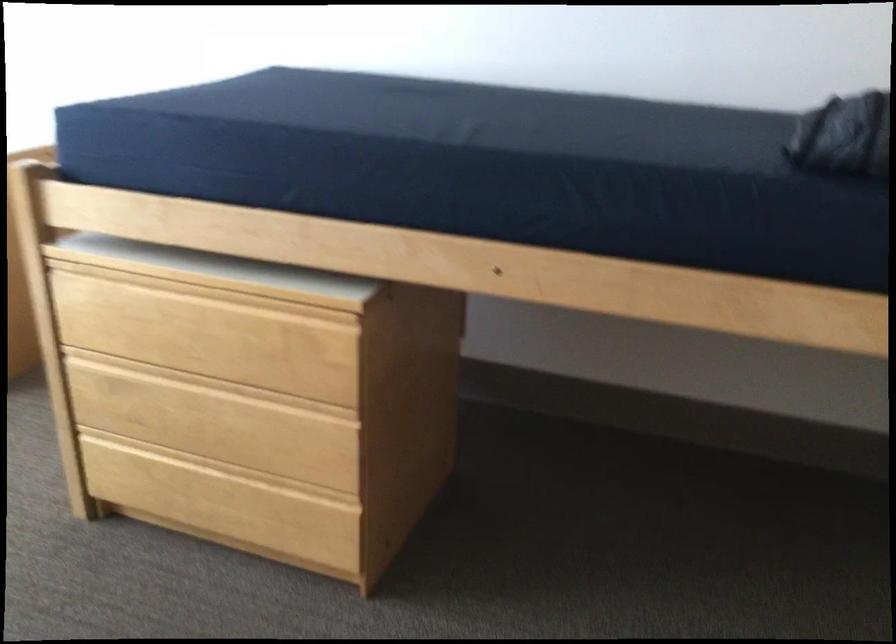
The width and height of the screenshot is (896, 644). I want to click on the bottom drawer handle, so click(217, 272).